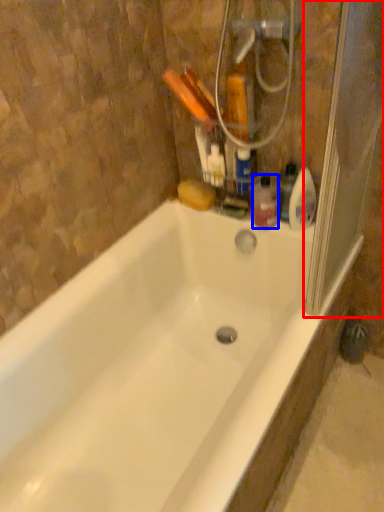
Question: Which point is closer to the camera, screen door (highlighted by a red box) or toiletry (highlighted by a blue box)?

Choices:
 (A) screen door
 (B) toiletry

Answer: (A)